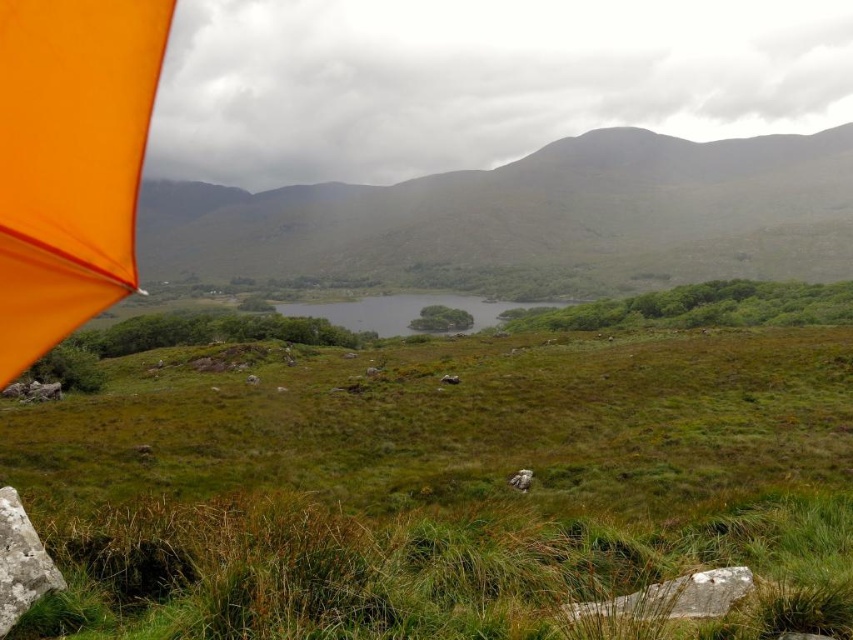
In the scene shown: You are standing at the edge of the green grassy lake at center and want to reach the green grassy field at center. Which direction should you walk to get there?

You should walk to the right to reach the green grassy field at center from the green grassy lake at center because the green grassy field at center is located to the right of the green grassy lake at center.

What is the 2D coordinate of the green grassy field at center?

The green grassy field at center is located at the 2D coordinate point of (445, 488).

You are planning to set up a picnic in the green grassy field at center and want to bring along the orange fabric umbrella at upper left for shade. Considering their sizes, will the umbrella be able to provide sufficient shade for the entire picnic area?

The green grassy field at center has a larger size compared to orange fabric umbrella at upper left, meaning the umbrella may not be large enough to cover the entire picnic area.